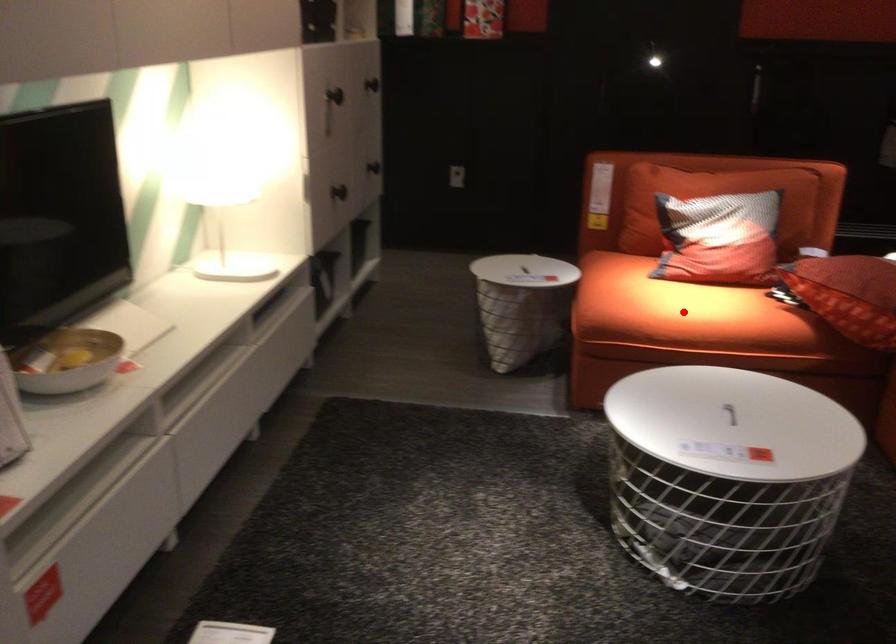
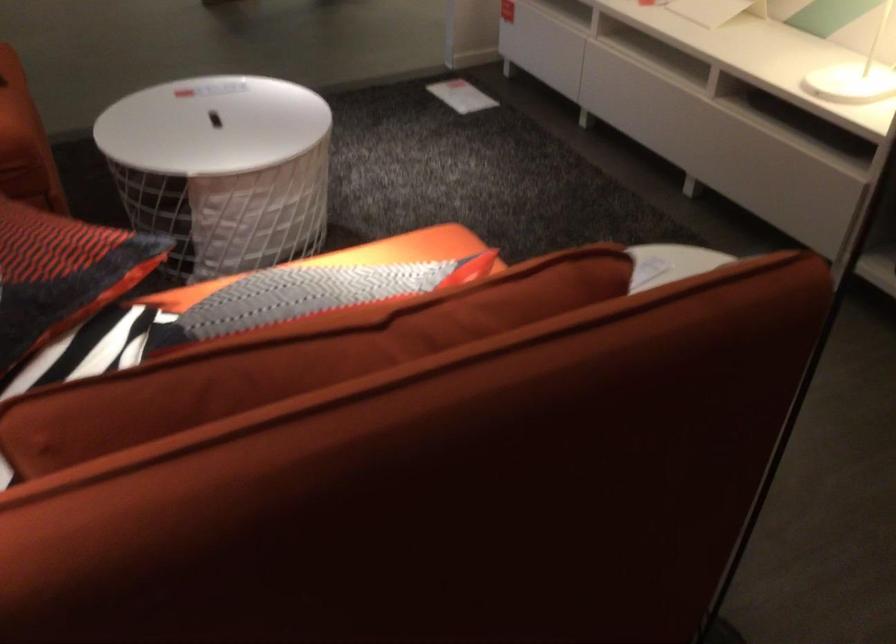
Question: I am providing you with two images of the same scene from different viewpoints. A red point is marked on the first image. At the location where the point appears in image 1, is it still visible in image 2?

Choices:
 (A) Yes
 (B) No

Answer: (B)